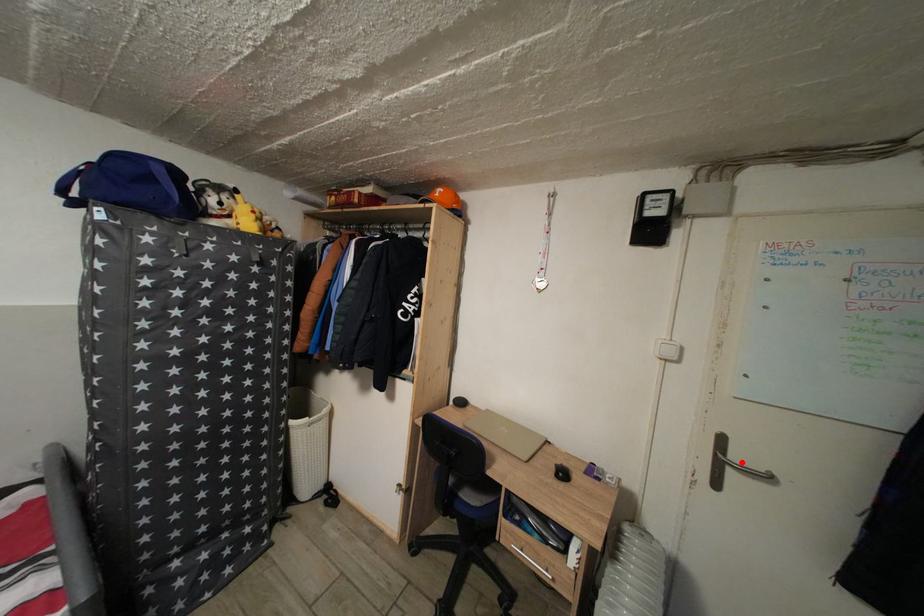
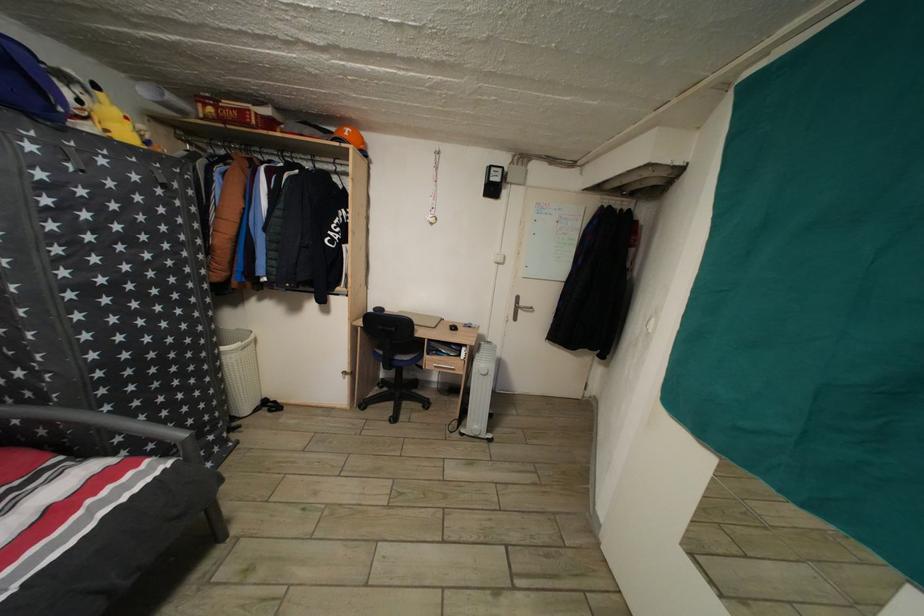
In the second image, find the point that corresponds to the highlighted location in the first image.

(529, 310)